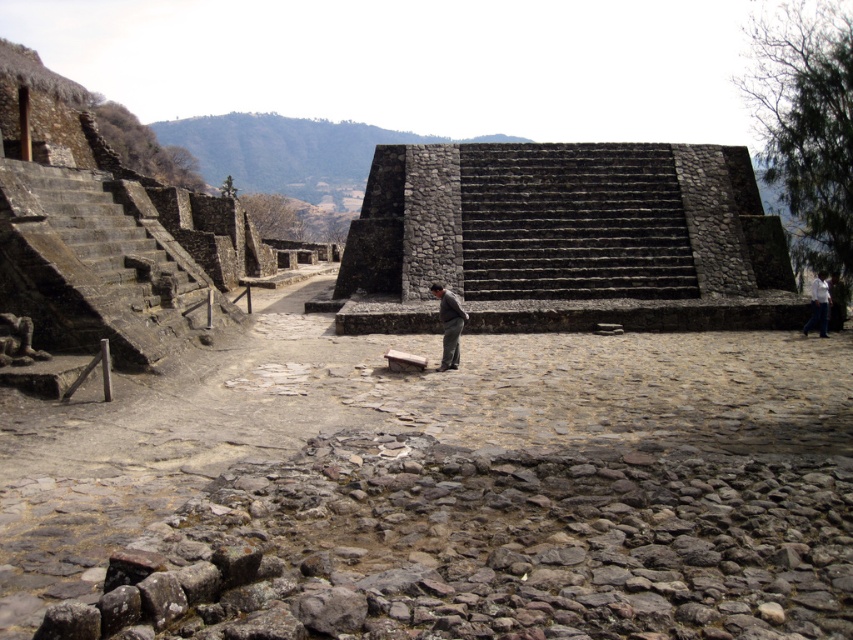
Looking at this image, you are an archaeologist standing at the base of the dark gray stone pyramid at center. You need to measure the distance to the pyramid to determine if your 100 feet long measuring tape is sufficient. Can you confirm if the distance is within the tape length?

The dark gray stone pyramid at center is 72.57 feet away from the camera, so yes, the 100 feet long measuring tape is sufficient to measure the distance.

You are standing at the base of the large stepped pyramid in the archaeological site. You notice two points marked in the image. The first point is at coordinates point (440, 289) and the second is at point (811, 292). Which of these points is closer to you?

Point (440, 289) is closer to the viewer than point (811, 292).

You are standing at the archaeological site and want to take a photo of the dark gray stone pyramid at center and the white cotton shirt at center. Which object should you focus on first to ensure both are in the frame?

You should focus on the dark gray stone pyramid at center first because it is closer to you than the white cotton shirt at center, ensuring both are in the frame.